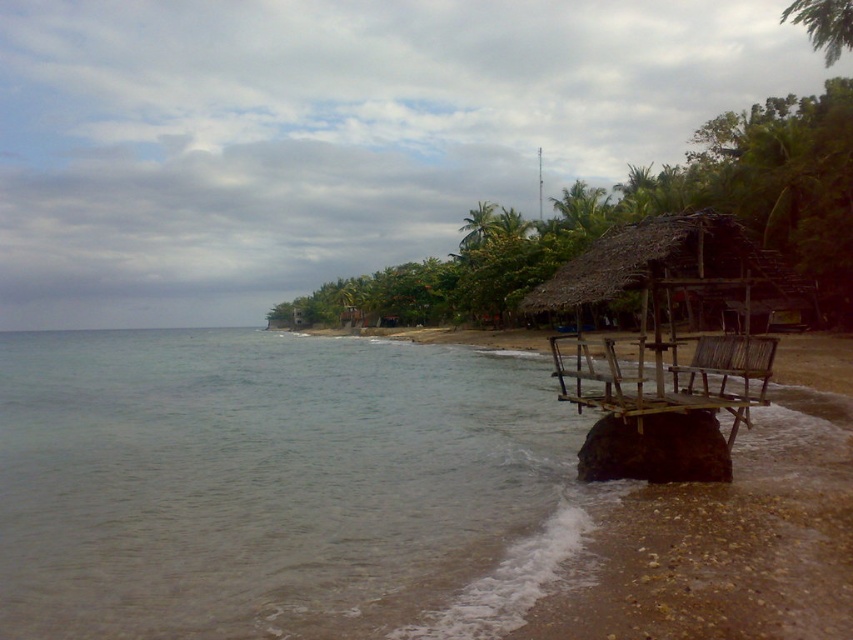
Question: Which point appears farthest from the camera in this image?

Choices:
 (A) (579, 202)
 (B) (596, 360)
 (C) (463, 458)

Answer: (A)

Question: Does thatched wood hut at right come in front of green leafy palm tree at center?

Choices:
 (A) yes
 (B) no

Answer: (A)

Question: Which point is closer to the camera?

Choices:
 (A) (15, 380)
 (B) (577, 212)

Answer: (A)

Question: Which point is closer to the camera?

Choices:
 (A) 437,481
 (B) 724,316
 (C) 576,220

Answer: (A)

Question: Considering the relative positions of clear water at lower left and green leafy palm tree at center in the image provided, where is clear water at lower left located with respect to green leafy palm tree at center?

Choices:
 (A) right
 (B) left

Answer: (B)

Question: From the image, what is the correct spatial relationship of clear water at lower left in relation to green leafy palm tree at center?

Choices:
 (A) right
 (B) left

Answer: (B)